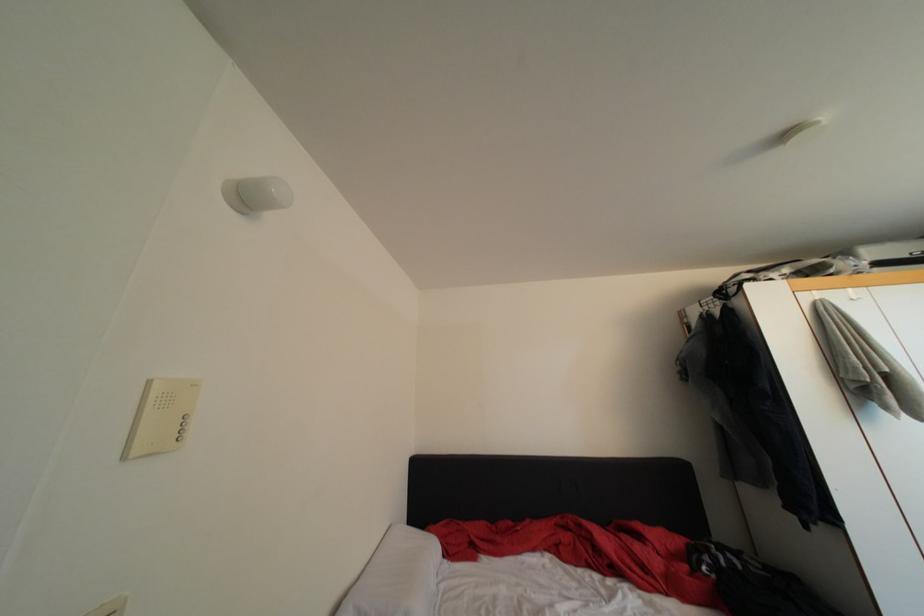
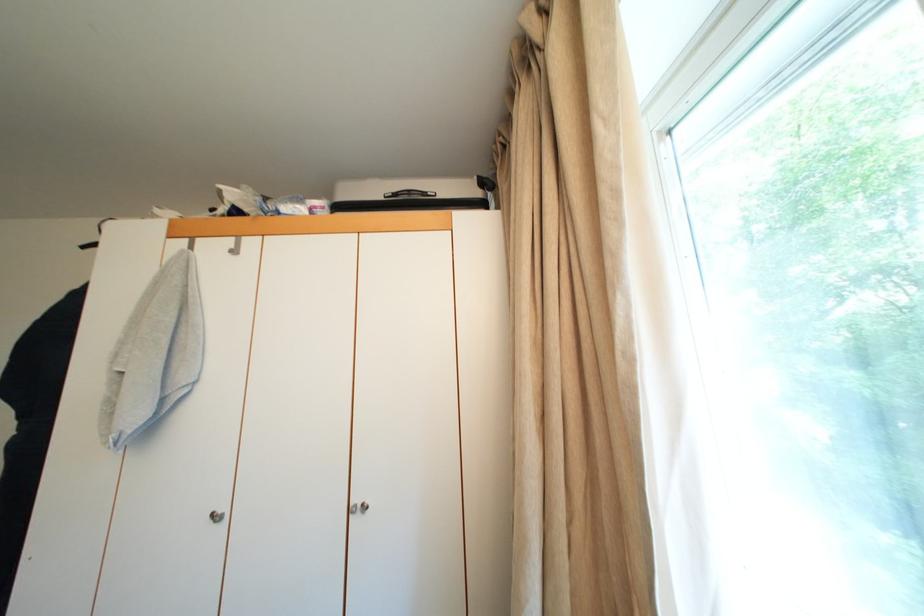
Question: Which direction would the cameraman need to move to produce the second image? Reply with the corresponding letter.

Choices:
 (A) Left
 (B) Right
 (C) Forward
 (D) Backward

Answer: (B)